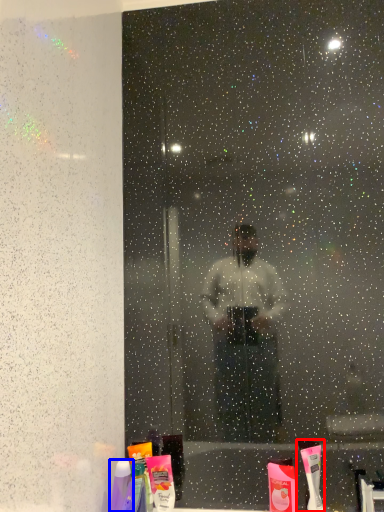
Question: Among these objects, which one is farthest to the camera, toothbrush (highlighted by a red box) or toiletry (highlighted by a blue box)?

Choices:
 (A) toothbrush
 (B) toiletry

Answer: (A)